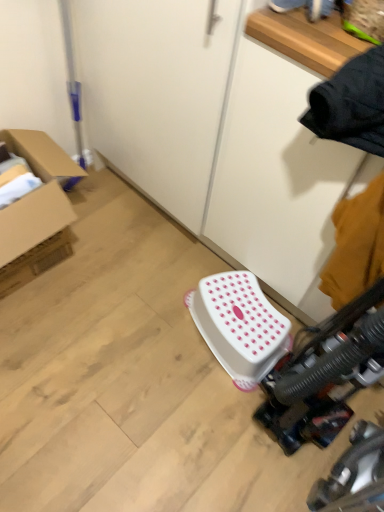
Locate an element on the screen. free space to the left of white plastic stool at center is located at coordinates (157, 317).